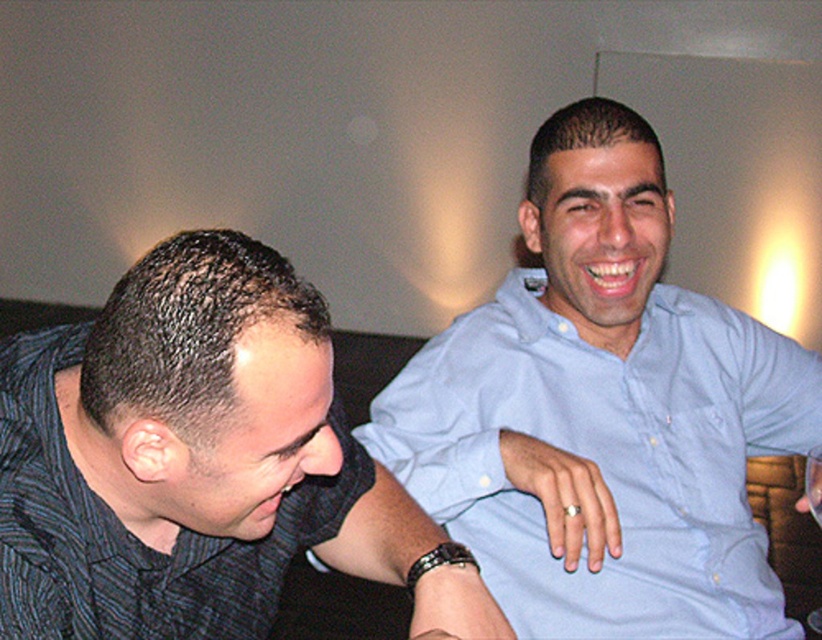
Question: Among these objects, which one is nearest to the camera?

Choices:
 (A) transparent glass at upper left
 (B) dark blue striped shirt at left
 (C) light blue cotton shirt at right

Answer: (B)

Question: Is dark blue striped shirt at left below transparent glass at upper left?

Choices:
 (A) yes
 (B) no

Answer: (B)

Question: In this image, where is dark blue striped shirt at left located relative to light blue cotton shirt at right?

Choices:
 (A) above
 (B) below

Answer: (B)

Question: Which of the following is the closest to the observer?

Choices:
 (A) light blue cotton shirt at right
 (B) transparent glass at upper left

Answer: (A)

Question: Does dark blue striped shirt at left lie behind light blue cotton shirt at right?

Choices:
 (A) yes
 (B) no

Answer: (B)

Question: Among these points, which one is nearest to the camera?

Choices:
 (A) (654, 364)
 (B) (15, 440)
 (C) (806, 461)

Answer: (B)